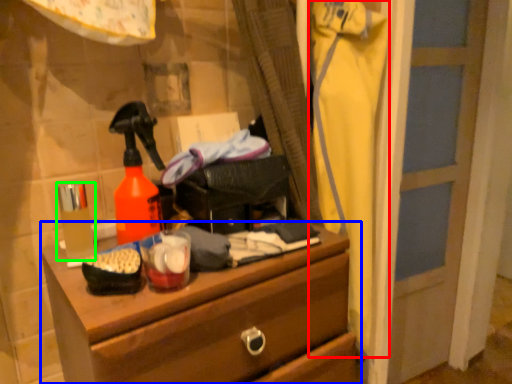
Question: Which is nearer to the clothing (highlighted by a red box)? chest of drawers (highlighted by a blue box) or toiletry (highlighted by a green box).

Choices:
 (A) chest of drawers
 (B) toiletry

Answer: (A)